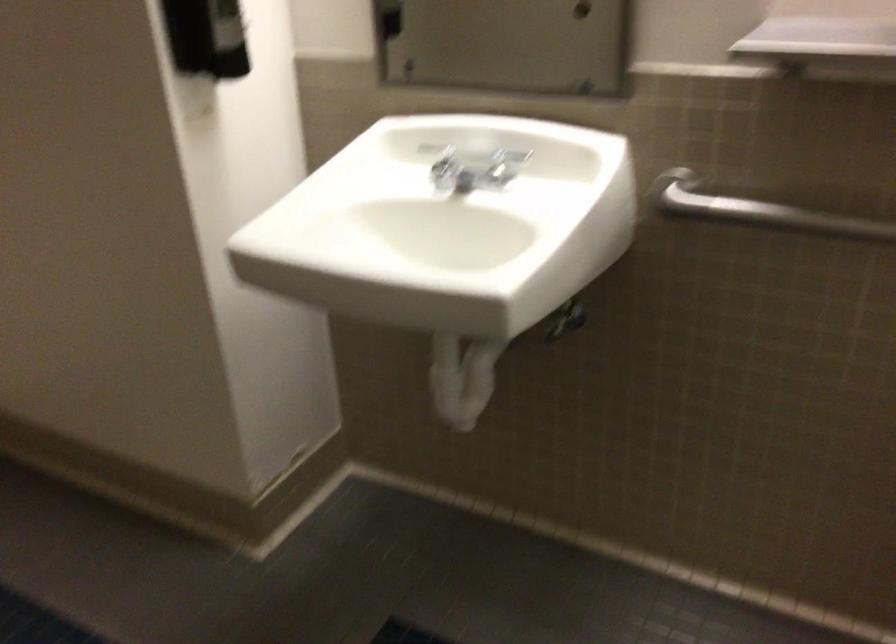
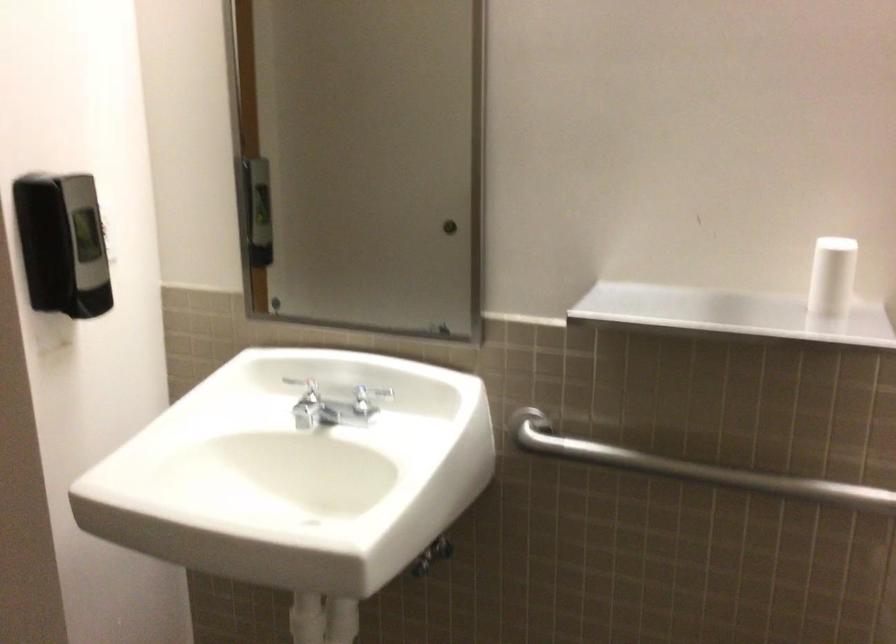
Locate, in the second image, the point that corresponds to (440,156) in the first image.

(305, 389)